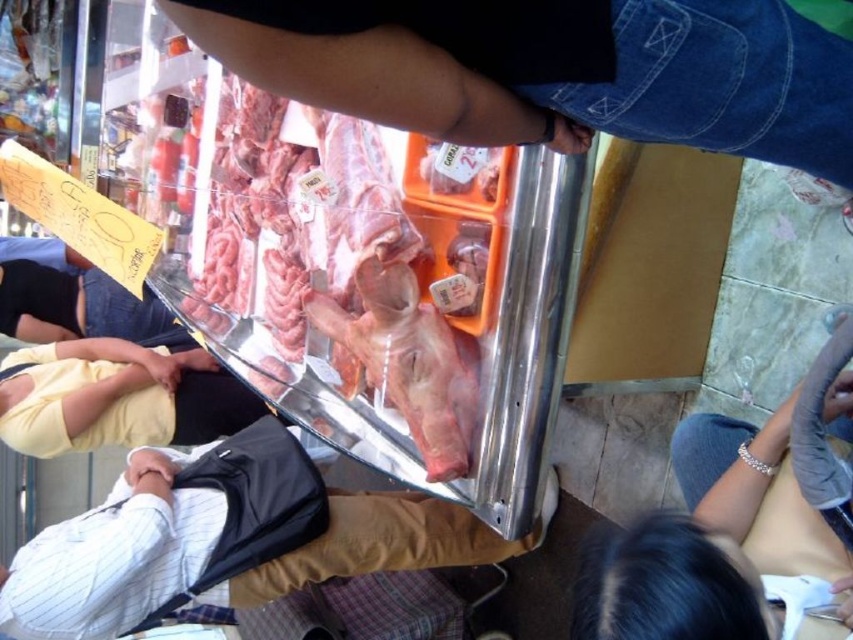
Who is taller, white striped shirt at lower left or yellow cotton shirt at lower left?

Standing taller between the two is white striped shirt at lower left.

Is white striped shirt at lower left positioned at the back of yellow cotton shirt at lower left?

No, white striped shirt at lower left is closer to the viewer.

Image resolution: width=853 pixels, height=640 pixels. I want to click on white striped shirt at lower left, so click(225, 541).